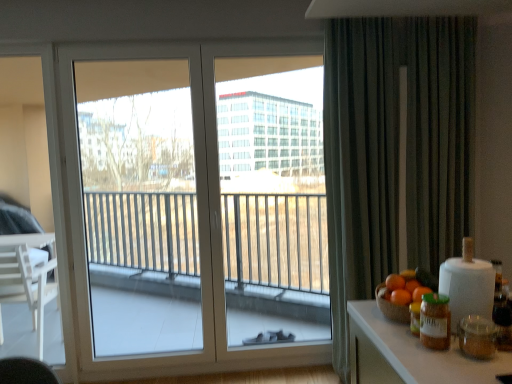
Question: Can we say green matte jar at right lies outside white glass window at center?

Choices:
 (A) no
 (B) yes

Answer: (B)

Question: Is green matte jar at right positioned far away from white glass window at center?

Choices:
 (A) no
 (B) yes

Answer: (B)

Question: From a real-world perspective, is green matte jar at right on top of white glass window at center?

Choices:
 (A) no
 (B) yes

Answer: (A)

Question: Can you confirm if green matte jar at right is smaller than white glass window at center?

Choices:
 (A) no
 (B) yes

Answer: (B)

Question: Does green matte jar at right have a greater height compared to white glass window at center?

Choices:
 (A) yes
 (B) no

Answer: (B)

Question: From the image's perspective, is green matte jar at right on white glass window at center?

Choices:
 (A) no
 (B) yes

Answer: (A)

Question: Can you confirm if dark grey textured curtain at right is positioned to the right of transparent glass window at left?

Choices:
 (A) no
 (B) yes

Answer: (B)

Question: Can you confirm if dark grey textured curtain at right is taller than transparent glass window at left?

Choices:
 (A) no
 (B) yes

Answer: (B)

Question: Is there a large distance between dark grey textured curtain at right and transparent glass window at left?

Choices:
 (A) no
 (B) yes

Answer: (B)

Question: Considering the relative sizes of dark grey textured curtain at right and transparent glass window at left in the image provided, is dark grey textured curtain at right shorter than transparent glass window at left?

Choices:
 (A) no
 (B) yes

Answer: (A)

Question: Is dark grey textured curtain at right looking in the opposite direction of transparent glass window at left?

Choices:
 (A) yes
 (B) no

Answer: (B)

Question: Considering the relative sizes of dark grey textured curtain at right and transparent glass window at left in the image provided, is dark grey textured curtain at right thinner than transparent glass window at left?

Choices:
 (A) yes
 (B) no

Answer: (B)

Question: Does orange matte at right, the 2th orange in the front-to-back sequence, have a greater width compared to white glass window at center?

Choices:
 (A) yes
 (B) no

Answer: (A)